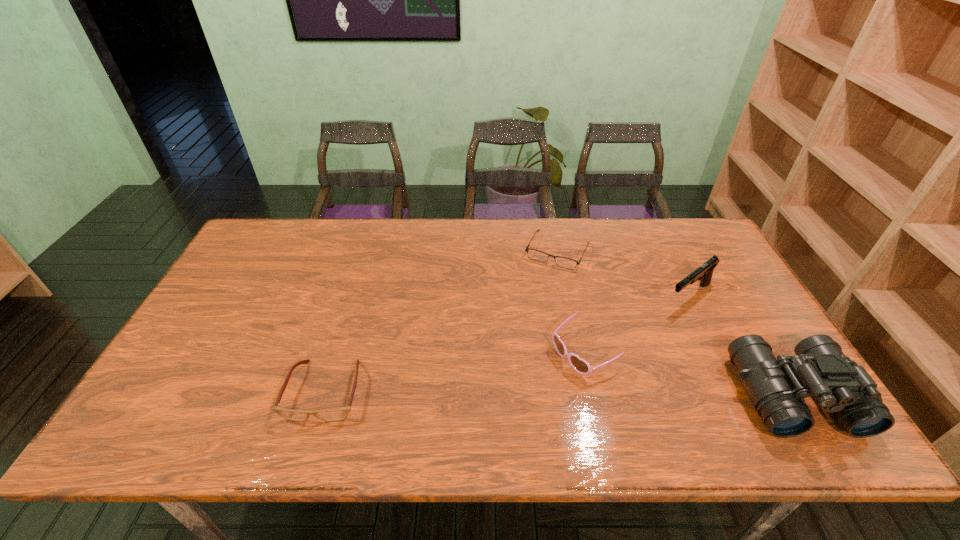
In order to click on sunglasses situated at the near edge in this screenshot , I will do `click(581, 366)`.

The height and width of the screenshot is (540, 960). I want to click on binoculars situated at the right edge, so click(777, 387).

The width and height of the screenshot is (960, 540). Identify the location of gun situated at the right edge. (704, 273).

Find the location of a particular element. This screenshot has height=540, width=960. object that is positioned at the near right corner is located at coordinates (777, 387).

You are a GUI agent. You are given a task and a screenshot of the screen. Output one action in this format:
    pyautogui.click(x=<x>, y=<y>)
    Task: Click on the free space at the far edge
    This screenshot has width=960, height=540.
    Given the screenshot: What is the action you would take?
    pyautogui.click(x=330, y=256)

The width and height of the screenshot is (960, 540). In the image, there is a desktop. Identify the location of vacant area at the near edge. (250, 389).

Find the location of a particular element. The image size is (960, 540). vacant region at the right edge of the desktop is located at coordinates (729, 366).

Image resolution: width=960 pixels, height=540 pixels. I want to click on free space at the far left corner of the desktop, so click(280, 226).

Identify the location of vacant region at the near left corner of the desktop. (188, 404).

Where is `blank region between the farthest object and the left spectacles`? The height and width of the screenshot is (540, 960). blank region between the farthest object and the left spectacles is located at coordinates (442, 321).